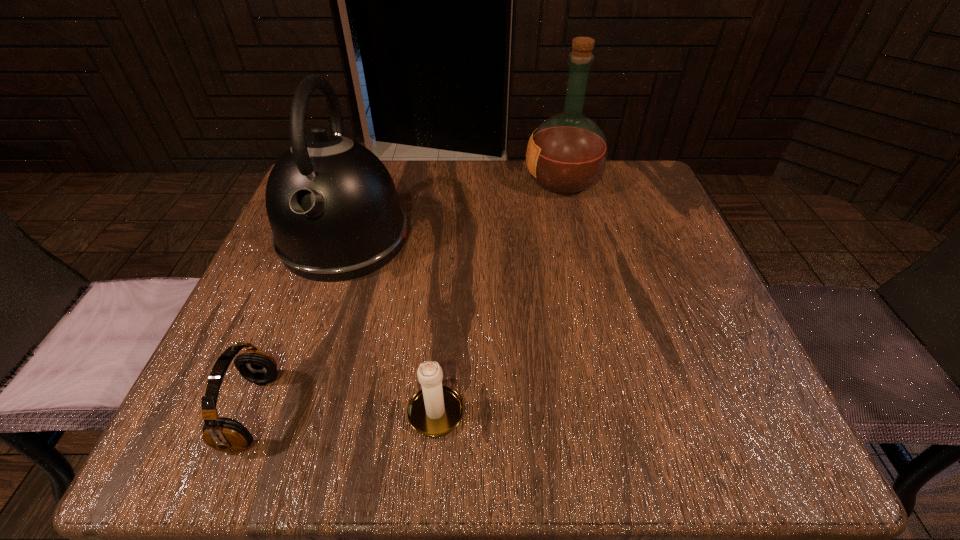
Locate an element on the screen. This screenshot has height=540, width=960. object present at the near left corner is located at coordinates (223, 434).

Locate an element on the screen. This screenshot has height=540, width=960. object that is at the far right corner is located at coordinates (567, 153).

In the image, there is a desktop. Identify the location of free space at the far edge. (492, 162).

This screenshot has width=960, height=540. In the image, there is a desktop. Identify the location of blank space at the near edge. (519, 414).

Find the location of `vacant space at the left edge of the desktop`. vacant space at the left edge of the desktop is located at coordinates (334, 306).

This screenshot has height=540, width=960. What are the coordinates of `vacant area at the far right corner of the desktop` in the screenshot? It's located at (631, 199).

In the image, there is a desktop. Identify the location of free region at the near right corner. This screenshot has height=540, width=960. (754, 448).

Identify the location of free space between the kettle and the rightmost object. Image resolution: width=960 pixels, height=540 pixels. (453, 210).

Identify the location of free space between the kettle and the headset. (298, 325).

In order to click on vacant space in between the candle holder and the kettle in this screenshot , I will do `click(391, 323)`.